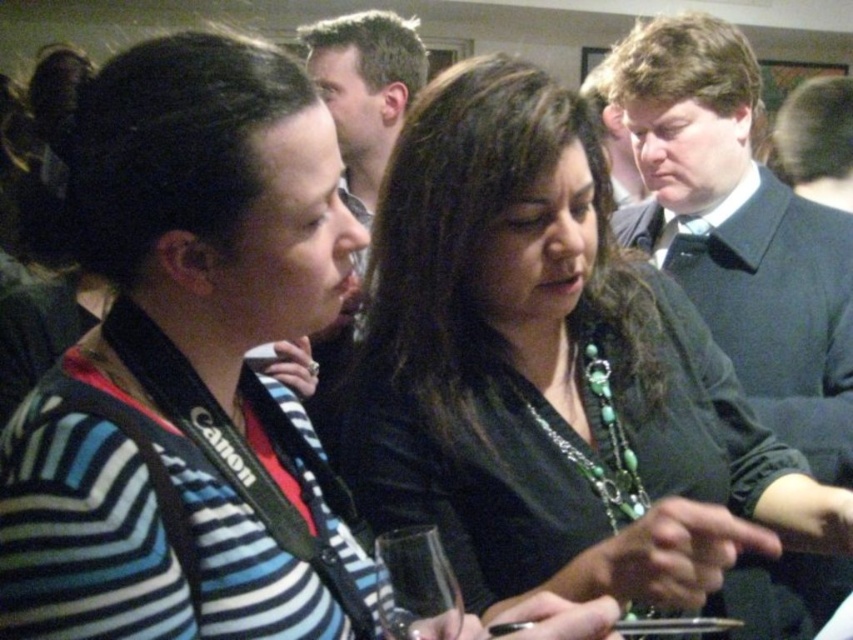
Is dark blue suit at center shorter than transparent glass at center?

No.

Is point (738, 35) positioned behind point (422, 532)?

Yes, it is behind point (422, 532).

Between point (672, 230) and point (422, 545), which one is positioned behind?

Positioned behind is point (672, 230).

Where is `dark blue suit at center`? dark blue suit at center is located at coordinates (740, 230).

Can you confirm if striped sweater at center is positioned to the right of dark blue suit at center?

In fact, striped sweater at center is to the left of dark blue suit at center.

Which of these two, striped sweater at center or dark blue suit at center, stands shorter?

With less height is striped sweater at center.

Where is `striped sweater at center`? Image resolution: width=853 pixels, height=640 pixels. striped sweater at center is located at coordinates (189, 362).

Who is taller, green beaded necklace at center or transparent glass at center?

green beaded necklace at center

Does green beaded necklace at center appear under transparent glass at center?

No, green beaded necklace at center is not below transparent glass at center.

Does point (706, 490) come closer to viewer compared to point (445, 573)?

No, (706, 490) is behind (445, 573).

You are a GUI agent. You are given a task and a screenshot of the screen. Output one action in this format:
    pyautogui.click(x=<x>, y=<y>)
    Task: Click on the green beaded necklace at center
    
    Given the screenshot: What is the action you would take?
    pyautogui.click(x=552, y=372)